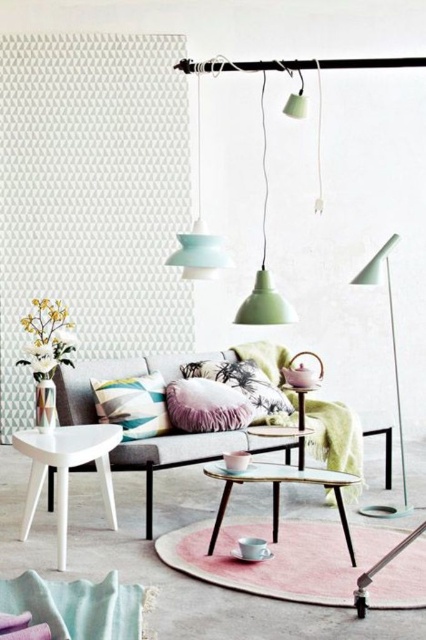
You are standing in the living room and want to take a photo of both the point at coordinates point (247, 472) and point (192, 236). Since you want both points to be in focus, which point should you focus on to ensure both are sharp?

You should focus on the point at coordinates point (192, 236) because it is farther from the camera than point (247, 472). By focusing on the farther point, the closer point will also be within the depth of field, ensuring both are sharp.

You are a delivery person trying to place a small package on the coffee table. The package is 10 centimeters wide. Can you place the package between the striped fabric pillow at center and the metallic glass coffee table at center without moving either object?

The distance between the striped fabric pillow at center and the metallic glass coffee table at center is 86.43 centimeters. Since the package is only 10 centimeters wide, there is enough space to place it between them without moving either object.